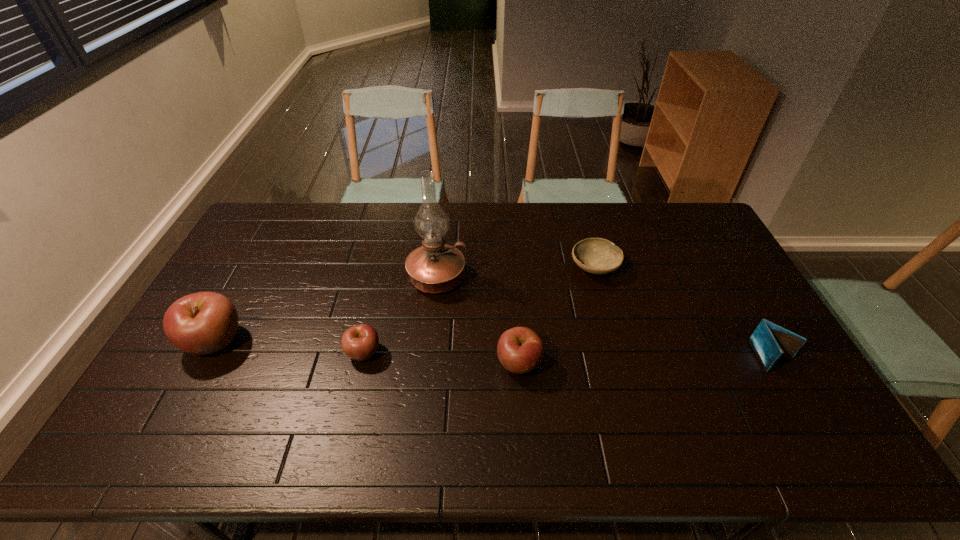
Observe the arrangement of all apples in the image. To keep them evenly spaced, where would you place another apple on the right? Please locate a free space. Please provide its 2D coordinates. Your answer should be formatted as a tuple, i.e. [(x, y)], where the tuple contains the x and y coordinates of a point satisfying the conditions above.

[(682, 375)]